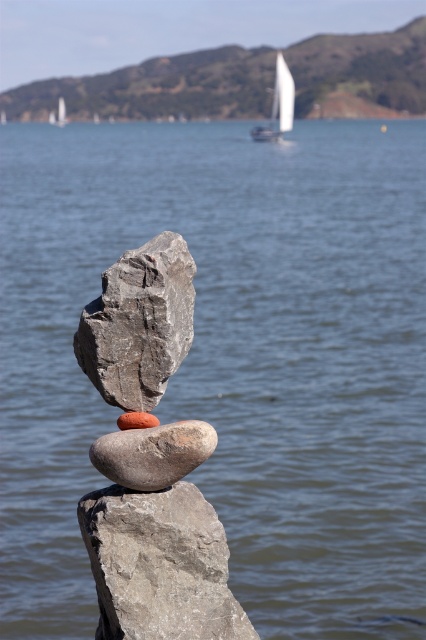
You are a geologist examining the rock formation. You notice the gray rock at center and the smooth orange rock at center. Which rock is positioned higher in the stack?

The gray rock at center is positioned higher than the smooth orange rock at center in the stack.

You are a photographer trying to capture the balanced rock formation. You notice the smooth gray rock at upper center and the white sailboat at upper center in your viewfinder. Which object appears larger in the photo?

The smooth gray rock at upper center appears much taller than the white sailboat at upper center, so it will look larger in the photo.

You are standing at the base of the rock formation in the coastal scene. There is a smooth gray rock marked at point (158, 88). Which direction should you look to see the smooth gray rock at upper center?

The point (158, 88) marks the smooth gray rock at upper center, so you should look upward to see it.